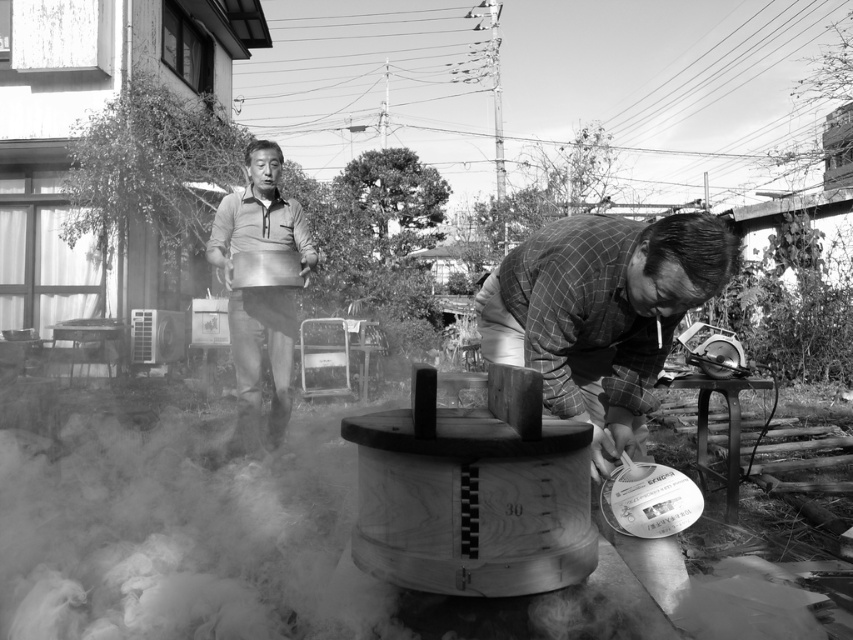
Question: Which of the following is the farthest from the observer?

Choices:
 (A) matte gray shirt at upper center
 (B) wooden plaid shirt at lower right

Answer: (A)

Question: Considering the relative positions of wooden plaid shirt at lower right and matte gray shirt at upper center in the image provided, where is wooden plaid shirt at lower right located with respect to matte gray shirt at upper center?

Choices:
 (A) below
 (B) above

Answer: (A)

Question: Can you confirm if wooden plaid shirt at lower right is positioned to the right of matte gray shirt at upper center?

Choices:
 (A) yes
 (B) no

Answer: (A)

Question: Is wooden plaid shirt at lower right wider than matte gray shirt at upper center?

Choices:
 (A) no
 (B) yes

Answer: (B)